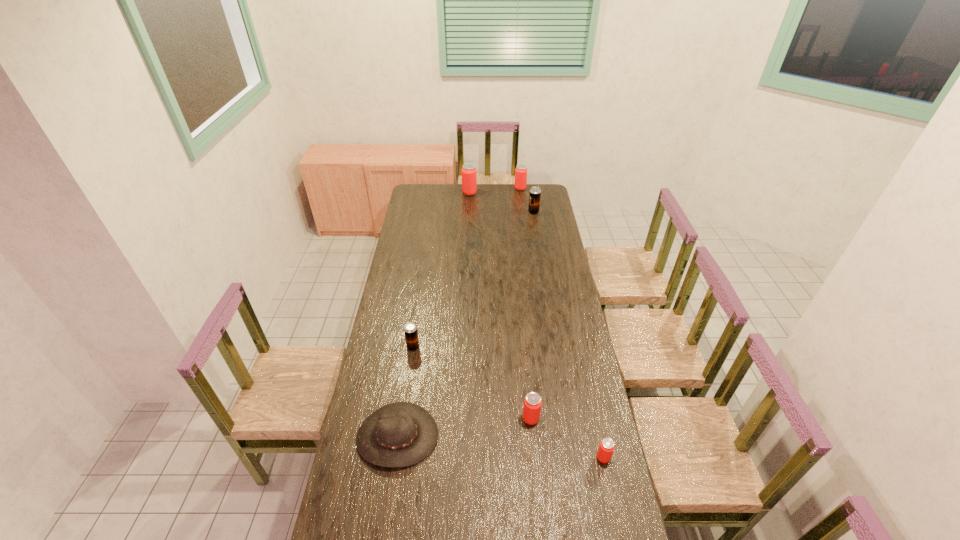
At what (x,y) coordinates should I click in order to perform the action: click on the rightmost beer can. Please return your answer as a coordinate pair (x, y). Image resolution: width=960 pixels, height=540 pixels. Looking at the image, I should click on (606, 447).

Identify the location of the rightmost red beer can. This screenshot has height=540, width=960. (606, 447).

Where is `vacant space situated 0.130m on the front of the third object from left to right`? vacant space situated 0.130m on the front of the third object from left to right is located at coordinates (468, 208).

Image resolution: width=960 pixels, height=540 pixels. In order to click on free space located 0.080m on the left of the third red beer can from left to right in this screenshot , I will do `click(502, 189)`.

The width and height of the screenshot is (960, 540). In order to click on vacant space located on the left of the fifth nearest object in this screenshot , I will do `click(509, 212)`.

This screenshot has height=540, width=960. Identify the location of vacant point located on the front of the left black beer can. (402, 422).

Locate an element on the screen. The width and height of the screenshot is (960, 540). free location located on the front of the fourth object from left to right is located at coordinates (542, 535).

The image size is (960, 540). Identify the location of free space located on the front-facing side of the hat. (383, 534).

The image size is (960, 540). Identify the location of vacant space located on the left of the smallest red beer can. (494, 457).

Identify the location of beer can located at the left edge. The width and height of the screenshot is (960, 540). (411, 335).